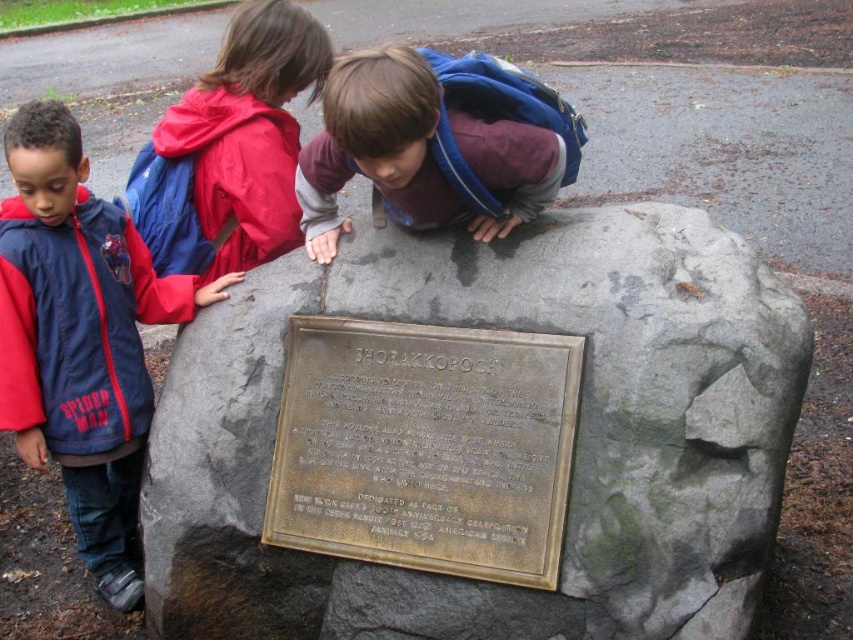
Question: Which of the following is the farthest from the observer?

Choices:
 (A) blue backpack at center
 (B) blue nylon jacket at left
 (C) red nylon backpack at upper left
 (D) bronze plaque at center

Answer: (C)

Question: Can you confirm if gray stone plaque at center is positioned below blue nylon jacket at left?

Choices:
 (A) no
 (B) yes

Answer: (B)

Question: Among these objects, which one is nearest to the camera?

Choices:
 (A) bronze plaque at center
 (B) blue backpack at center
 (C) blue nylon jacket at left
 (D) red nylon backpack at upper left

Answer: (B)

Question: Can you confirm if bronze plaque at center is smaller than blue nylon jacket at left?

Choices:
 (A) no
 (B) yes

Answer: (B)

Question: Is gray stone plaque at center behind red nylon backpack at upper left?

Choices:
 (A) no
 (B) yes

Answer: (A)

Question: Which object appears farthest from the camera in this image?

Choices:
 (A) blue nylon jacket at left
 (B) blue backpack at center
 (C) gray stone plaque at center
 (D) bronze plaque at center

Answer: (A)